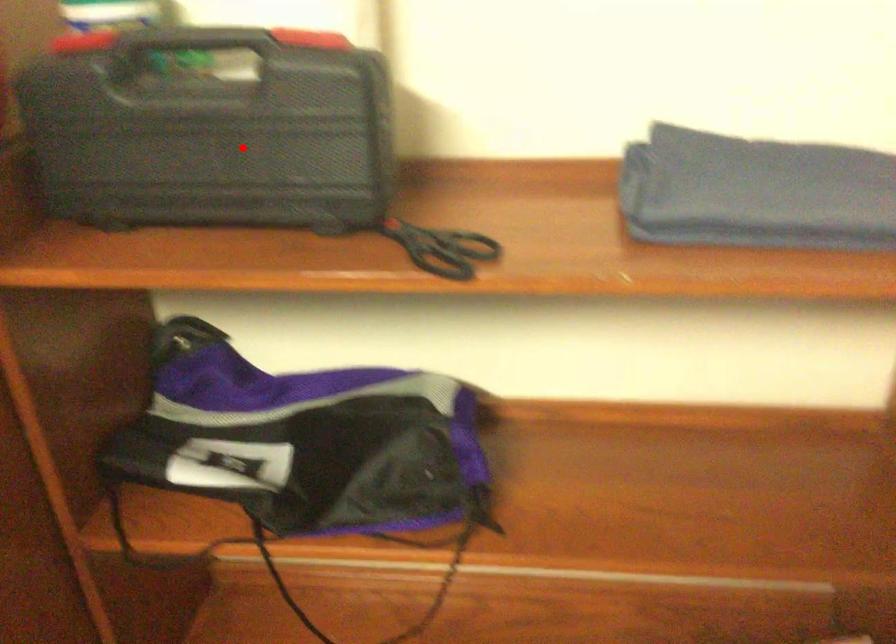
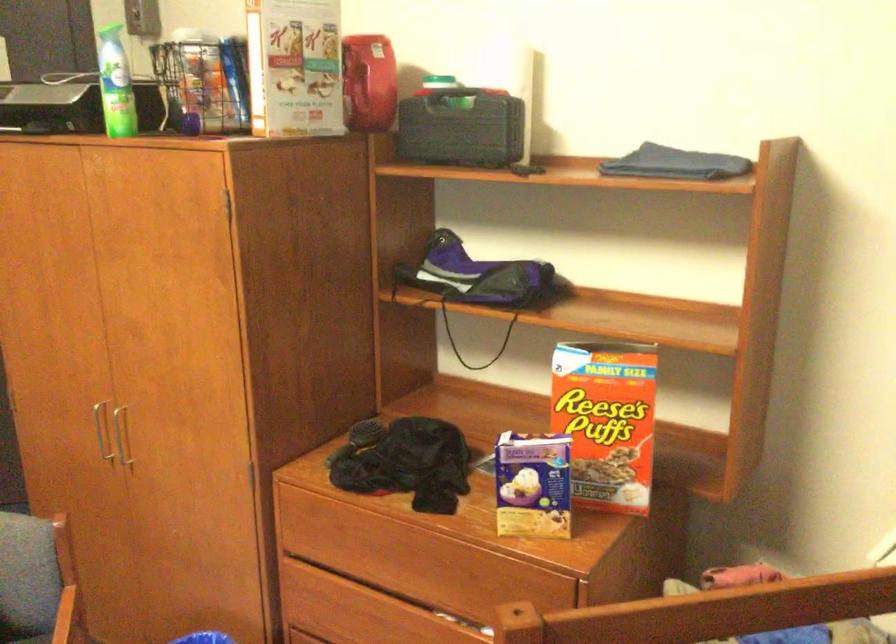
Question: I am providing you with two images of the same scene from different viewpoints. Image1 has a red point marked. In image2, the corresponding 3D location appears at what relative position? Reply with the corresponding letter.

Choices:
 (A) Closer
 (B) Farther

Answer: (B)